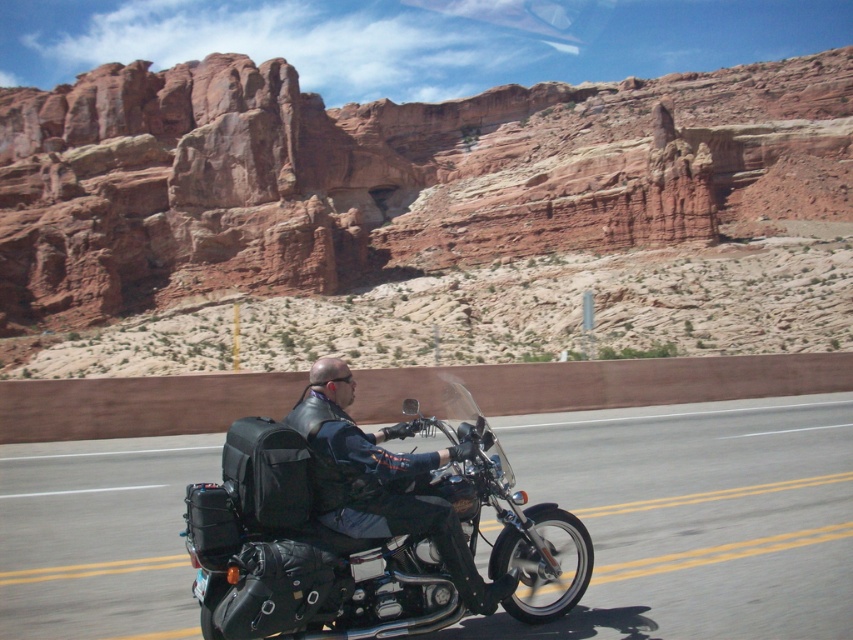
You are a photographer trying to capture the motorcyclist and their gear. You need to know the relative positions of the shiny black motorcycle at center and the black fabric backpack at lower left to frame your shot. Which object is positioned to the right in the image?

The shiny black motorcycle at center is to the right of black fabric backpack at lower left.

You are a photographer planning to capture the motorcyclist and their gear. You need to ensure both the black leather motorcycle at center and the black fabric backpack at lower left are in the same frame. Based on their positions, which object should you focus on first to include both in your shot?

The black leather motorcycle at center is located below the black fabric backpack at lower left, so you should focus on the black fabric backpack at lower left first to ensure both objects are in the frame.